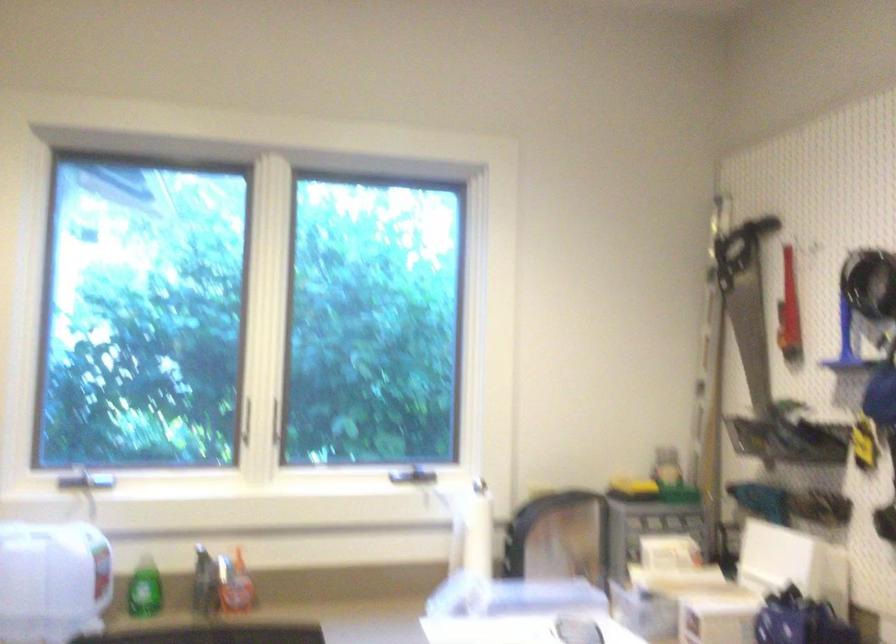
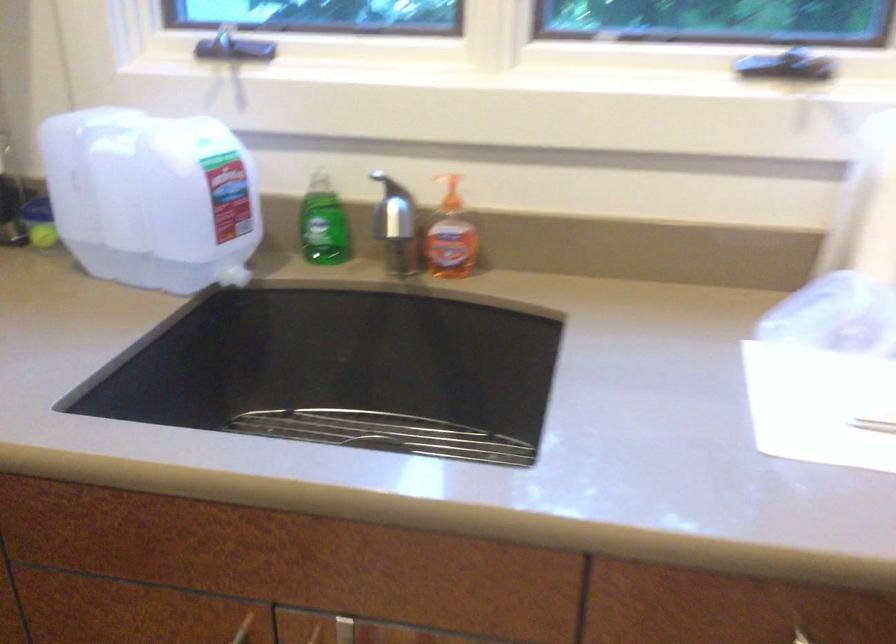
Where in the second image is the point corresponding to the point at 97,475 from the first image?

(243, 48)